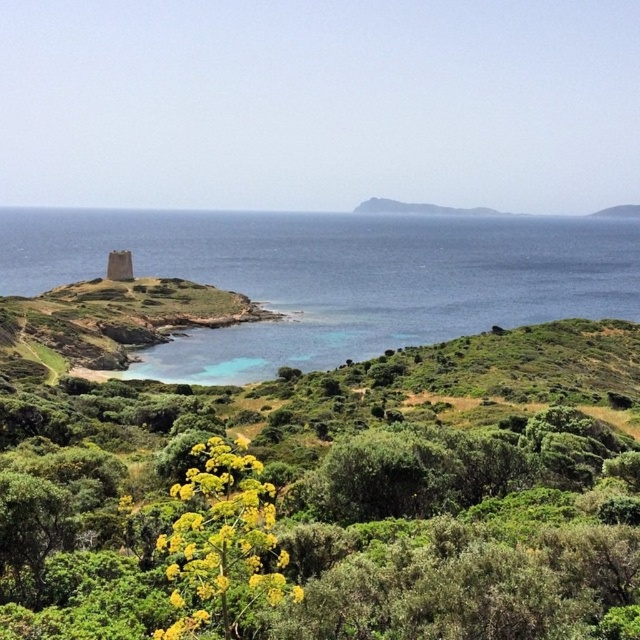
Question: Which point is farther to the camera?

Choices:
 (A) white stone tower at upper left
 (B) yellow flower at center
 (C) blue water at left

Answer: (A)

Question: Can you confirm if blue water at left is thinner than white stone tower at upper left?

Choices:
 (A) yes
 (B) no

Answer: (B)

Question: Is blue water at left below yellow flower at center?

Choices:
 (A) yes
 (B) no

Answer: (B)

Question: Estimate the real-world distances between objects in this image. Which object is farther from the yellow flower at center?

Choices:
 (A) blue water at left
 (B) white stone tower at upper left

Answer: (A)

Question: In this image, where is yellow flower at center located relative to white stone tower at upper left?

Choices:
 (A) below
 (B) above

Answer: (A)

Question: Among these points, which one is farthest from the camera?

Choices:
 (A) (118, 280)
 (B) (252, 538)

Answer: (A)